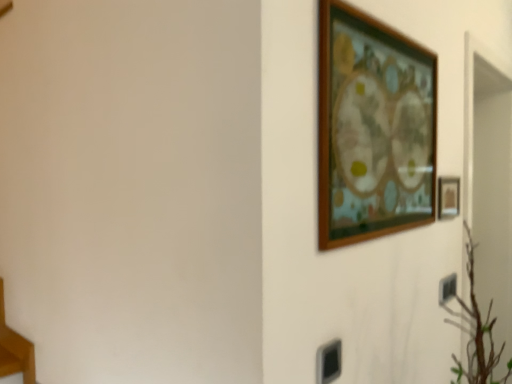
Question: From their relative heights in the image, would you say wooden table at lower left is taller or shorter than black plastic electric outlet at lower right?

Choices:
 (A) tall
 (B) short

Answer: (A)

Question: Does point (6, 336) appear closer or farther from the camera than point (439, 291)?

Choices:
 (A) closer
 (B) farther

Answer: (B)

Question: Considering the real-world distances, which object is farthest from the wooden table at lower left?

Choices:
 (A) wooden picture frame at upper right, which is the second picture frame from back to front
 (B) black plastic electric outlet at lower right
 (C) wooden picture frame at right, placed as the 1th picture frame when sorted from back to front

Answer: (C)

Question: Which is farther from the wooden table at lower left?

Choices:
 (A) wooden picture frame at upper right, arranged as the second picture frame when viewed from the right
 (B) black plastic electric outlet at lower right
 (C) wooden picture frame at right, which ranks as the 1th picture frame in right-to-left order

Answer: (C)